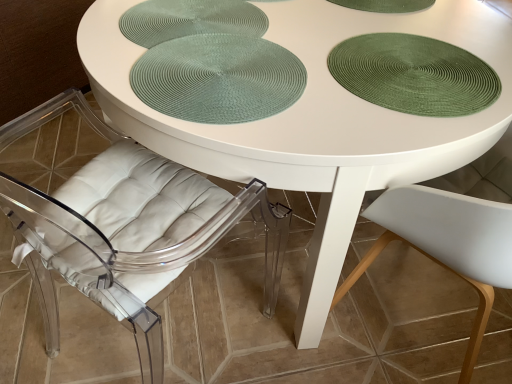
Locate an element on the screen. Image resolution: width=512 pixels, height=384 pixels. free location to the right of transparent acrylic chair at lower left is located at coordinates [x=268, y=323].